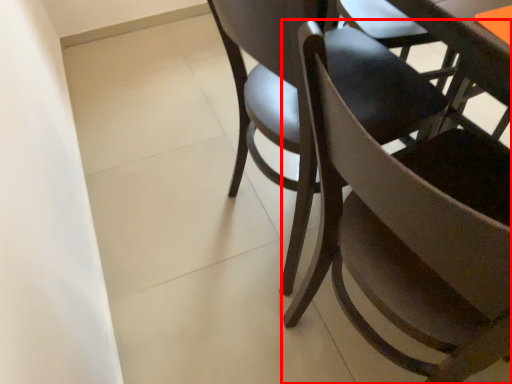
Question: From the image's perspective, what is the correct spatial positioning of chair (annotated by the red box) in reference to chair?

Choices:
 (A) above
 (B) below

Answer: (B)